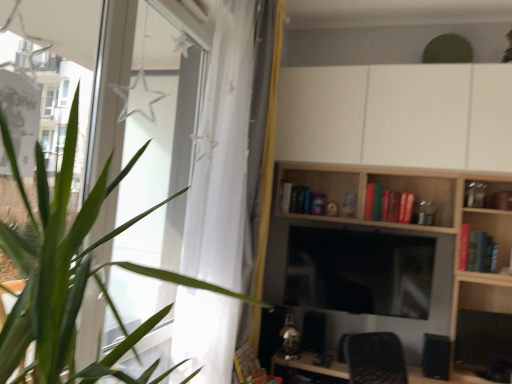
Question: From the image's perspective, is green matte book at upper center, which is the second book from right to left, above or below hardcover book at center, placed as the third book when sorted from back to front?

Choices:
 (A) above
 (B) below

Answer: (A)

Question: In terms of height, does green matte book at upper center, the second book when ordered from front to back, look taller or shorter compared to hardcover book at center, which is the 3th book from left to right?

Choices:
 (A) short
 (B) tall

Answer: (A)

Question: Which object is positioned closest to the white sheer curtain at left?

Choices:
 (A) green leafy plant at left
 (B) hardcover book at center, the first book in the right-to-left sequence
 (C) matte black monitor at center
 (D) light wood shelf at center
 (E) green matte book at upper center, positioned as the second book in back-to-front order

Answer: (C)

Question: Based on their relative distances, which object is farther from the matte black monitor at center?

Choices:
 (A) green matte book at upper center, which is the second book from right to left
 (B) hardcover book at center, which is the 3th book from left to right
 (C) hardcover book at upper center, the 1th book positioned from the left
 (D) white sheer curtain at left
 (E) light wood shelf at center

Answer: (D)